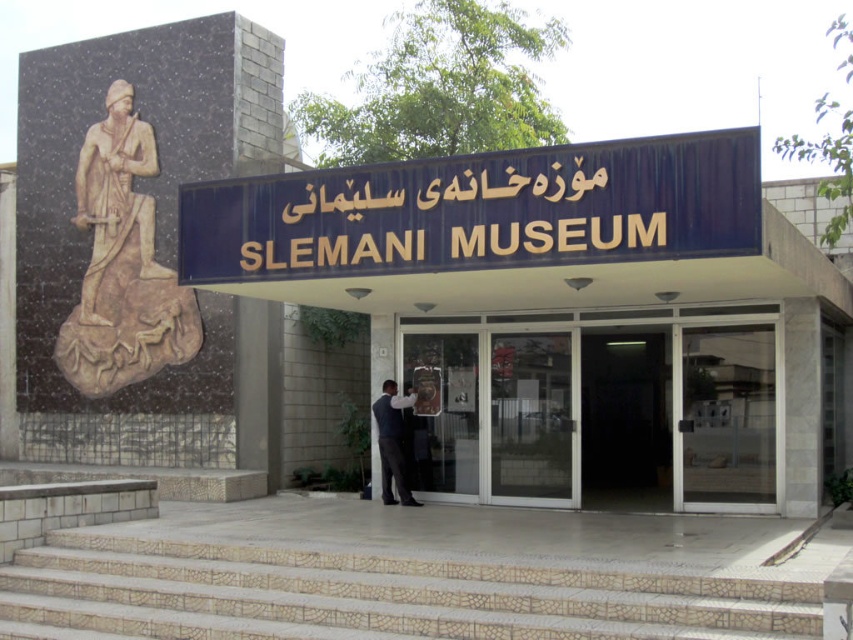
Looking at this image, you are a visitor standing in front of the Slemani Museum entrance. You see the beige stone statue at left and the dark blue suit at center. Which object is positioned higher from the ground?

The beige stone statue at left is located above the dark blue suit at center, so it is positioned higher from the ground.